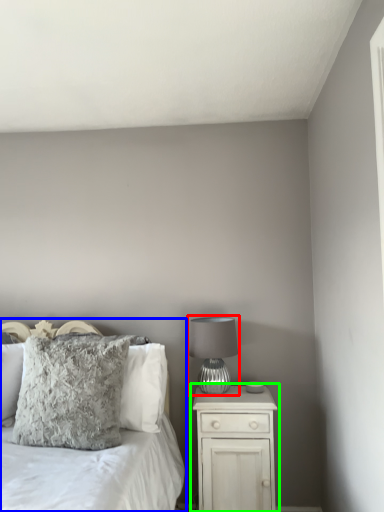
Question: Which object is positioned closest to table lamp (highlighted by a red box)? Select from bed (highlighted by a blue box) and nightstand (highlighted by a green box).

Choices:
 (A) bed
 (B) nightstand

Answer: (B)